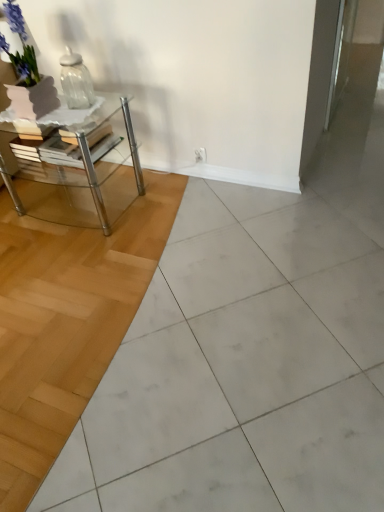
Question: Can you confirm if white glossy ceramic tile at center is wider than clear glass table at left?

Choices:
 (A) yes
 (B) no

Answer: (A)

Question: Is white glossy ceramic tile at center smaller than clear glass table at left?

Choices:
 (A) no
 (B) yes

Answer: (A)

Question: Would you say white glossy ceramic tile at center contains clear glass table at left?

Choices:
 (A) yes
 (B) no

Answer: (B)

Question: Is white glossy ceramic tile at center not close to clear glass table at left?

Choices:
 (A) no
 (B) yes

Answer: (A)

Question: Is white glossy ceramic tile at center at the right side of clear glass table at left?

Choices:
 (A) yes
 (B) no

Answer: (A)

Question: Is clear glass table at left to the left or to the right of white glossy ceramic tile at center in the image?

Choices:
 (A) right
 (B) left

Answer: (B)

Question: In the image, is clear glass table at left positioned in front of or behind white glossy ceramic tile at center?

Choices:
 (A) behind
 (B) front

Answer: (A)

Question: From their relative heights in the image, would you say clear glass table at left is taller or shorter than white glossy ceramic tile at center?

Choices:
 (A) short
 (B) tall

Answer: (B)

Question: Would you say clear glass table at left is inside or outside white glossy ceramic tile at center?

Choices:
 (A) inside
 (B) outside

Answer: (B)

Question: From the image's perspective, relative to clear glass jar at upper left, is white glossy ceramic tile at center above or below?

Choices:
 (A) above
 (B) below

Answer: (B)

Question: Considering the positions of white glossy ceramic tile at center and clear glass jar at upper left in the image, is white glossy ceramic tile at center taller or shorter than clear glass jar at upper left?

Choices:
 (A) short
 (B) tall

Answer: (A)

Question: Looking at the image, does white glossy ceramic tile at center seem bigger or smaller compared to clear glass jar at upper left?

Choices:
 (A) small
 (B) big

Answer: (B)

Question: Relative to clear glass jar at upper left, is white glossy ceramic tile at center in front or behind?

Choices:
 (A) front
 (B) behind

Answer: (A)

Question: In the image, is clear glass jar at upper left on the left side or the right side of clear glass table at left?

Choices:
 (A) right
 (B) left

Answer: (A)

Question: Is clear glass jar at upper left bigger or smaller than clear glass table at left?

Choices:
 (A) small
 (B) big

Answer: (A)